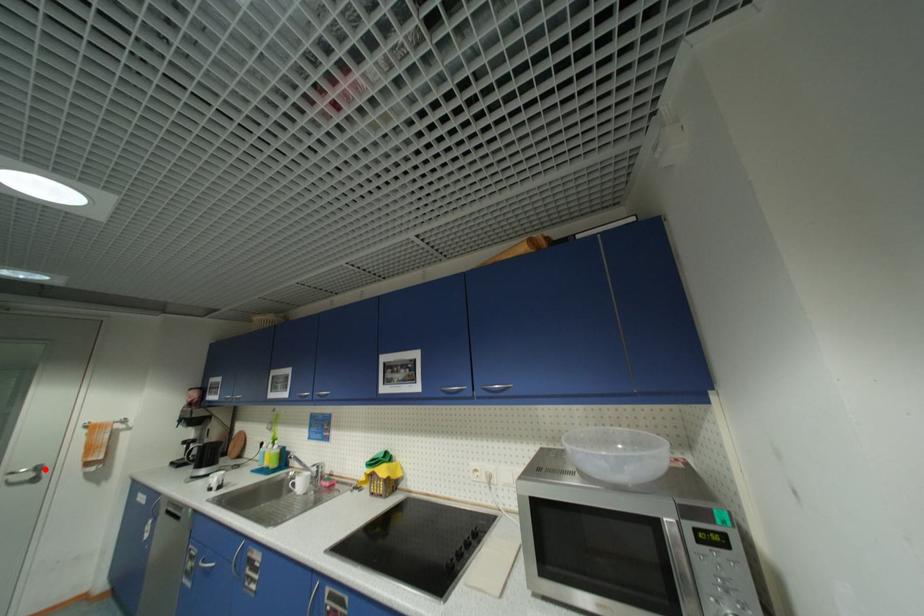
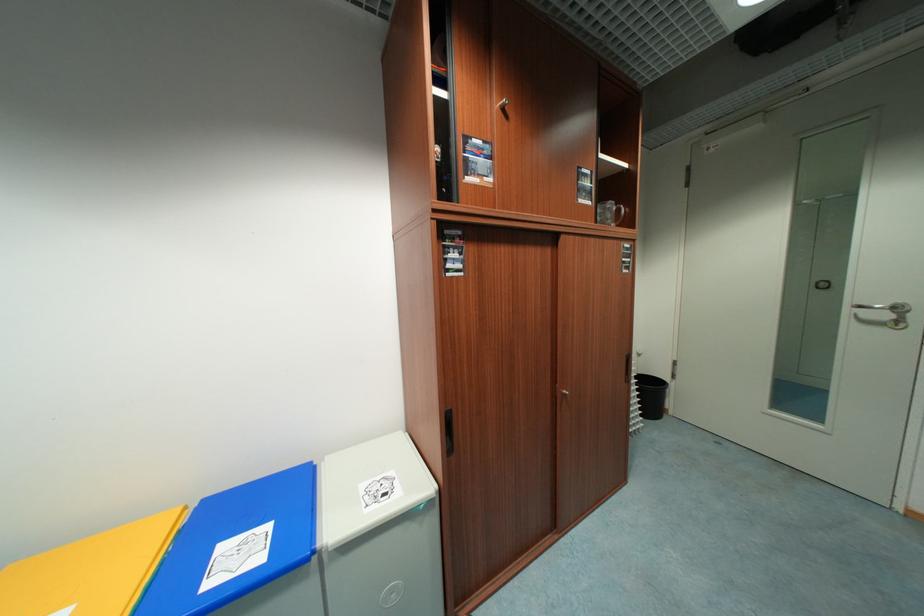
The point at the highlighted location is marked in the first image. Where is the corresponding point in the second image?

(904, 310)